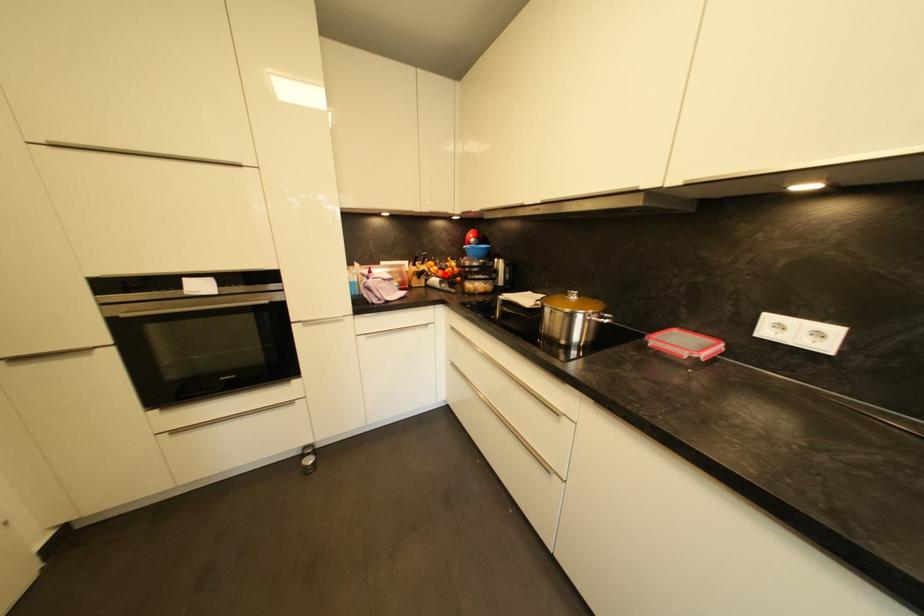
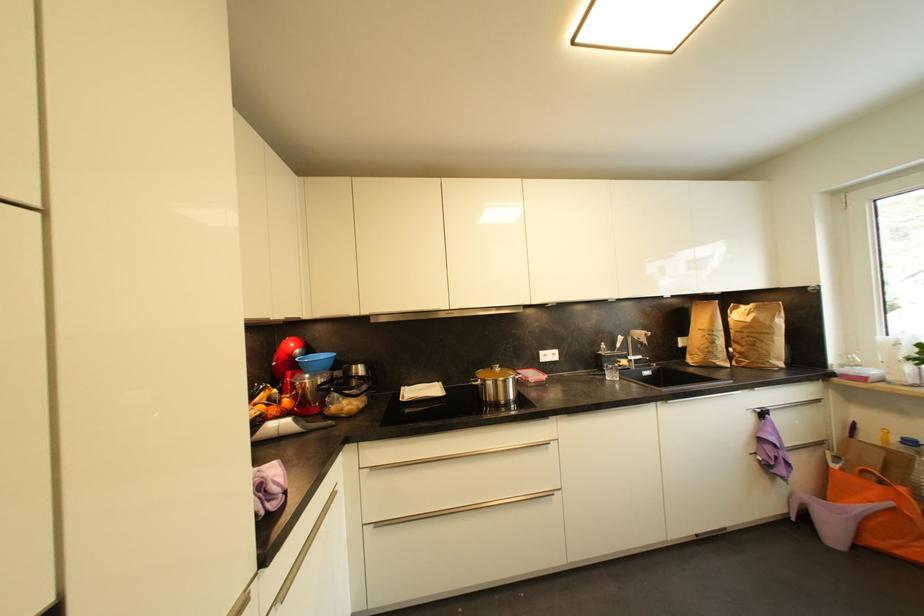
Locate, in the second image, the point that corresponds to the highlighted location in the first image.

(277, 411)